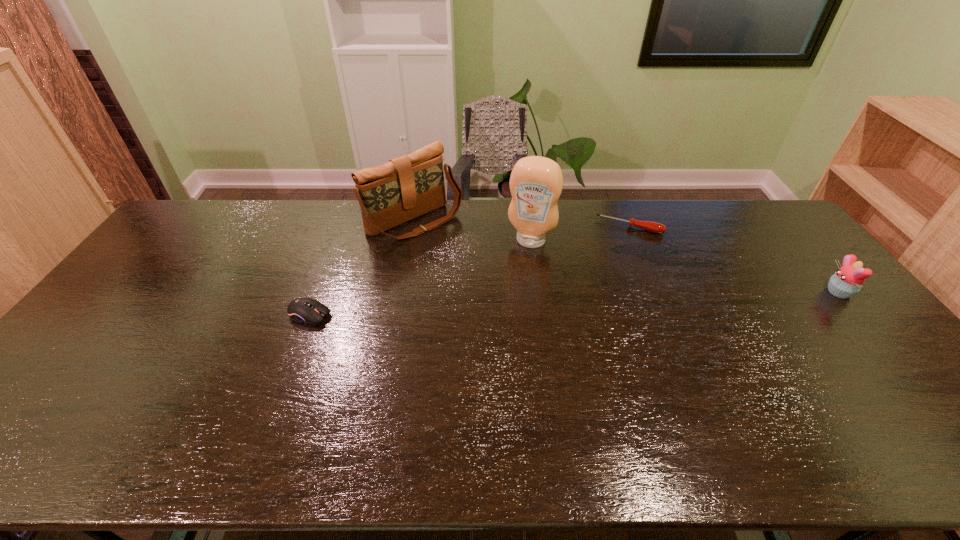
In order to click on free space on the desktop that is between the fourth tallest object and the cupcake and is positioned on the front-facing side of the shoulder bag in this screenshot , I will do `click(515, 306)`.

This screenshot has width=960, height=540. What are the coordinates of `free space on the desktop that is between the leftmost object and the third shortest object and is positioned at the tip of the second object from right to left` in the screenshot? It's located at (608, 302).

What are the coordinates of `vacant spot on the desktop that is between the leftmost object and the cupcake and is positioned on the label of the condiment` in the screenshot? It's located at (507, 306).